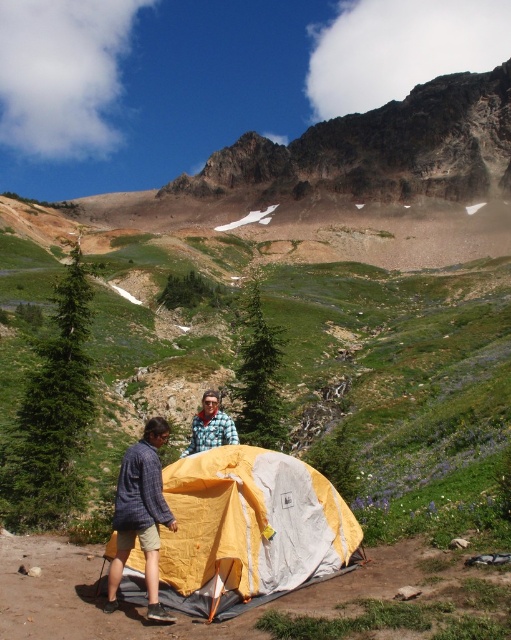
Question: Is yellow fabric tent at lower center in front of brushed metal jacket at center?

Choices:
 (A) yes
 (B) no

Answer: (A)

Question: Can you confirm if yellow fabric tent at lower center is thinner than brushed metal jacket at center?

Choices:
 (A) yes
 (B) no

Answer: (B)

Question: Which object is closer to the camera taking this photo?

Choices:
 (A) yellow fabric tent at center
 (B) brushed metal jacket at center

Answer: (A)

Question: Which point appears farthest from the camera in this image?

Choices:
 (A) (122, 509)
 (B) (260, 513)

Answer: (B)

Question: Which object is positioned farthest from the plaid shirt at center?

Choices:
 (A) yellow fabric tent at lower center
 (B) brushed metal jacket at center
 (C) yellow fabric tent at center

Answer: (B)

Question: Can you confirm if plaid shirt at center is thinner than brushed metal jacket at center?

Choices:
 (A) no
 (B) yes

Answer: (A)